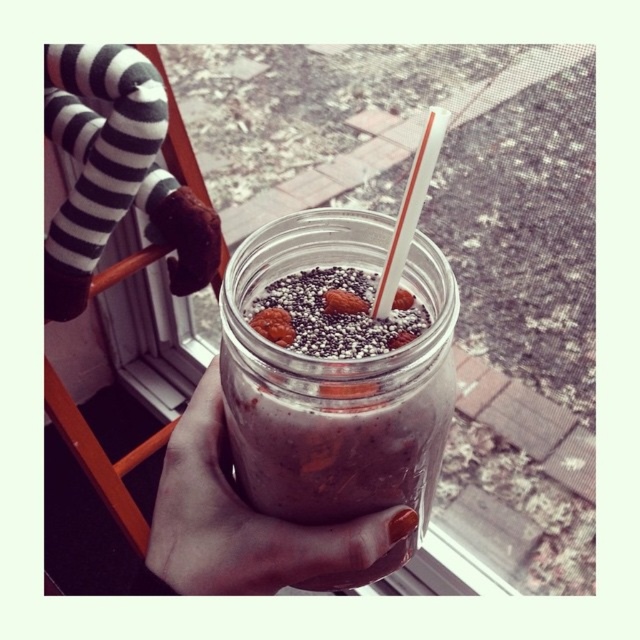
Based on the photo, you are a nutritionist analyzing the image of a drink. You need to determine if the smoothie at center is inside the translucent glass jar at center. Based on the spatial relationship between them, what is your conclusion?

The translucent glass jar at center is positioned under the smoothie at center, which means the smoothie is inside the jar.

You are a delivery person who needs to place a black striped socks at upper left and a smooth brown almond at center into a box that measures 14 inches in length. Can you fit both items in the box without overlapping them?

The black striped socks at upper left and smooth brown almond at center are 13.79 inches apart, so they can be placed in the box without overlapping since the distance between them is less than the box length of 14 inches.

You are a fashion designer observing the image. You need to decide which item to feature in your upcoming collection. Based on their sizes, which item from the black striped socks at upper left and the smooth brown almond at center would be more suitable for a closeup photo to highlight intricate details?

The black striped socks at upper left is bigger than the smooth brown almond at center, so the black striped socks at upper left would be more suitable for a closeup photo to highlight intricate details since it is larger and can better showcase details.